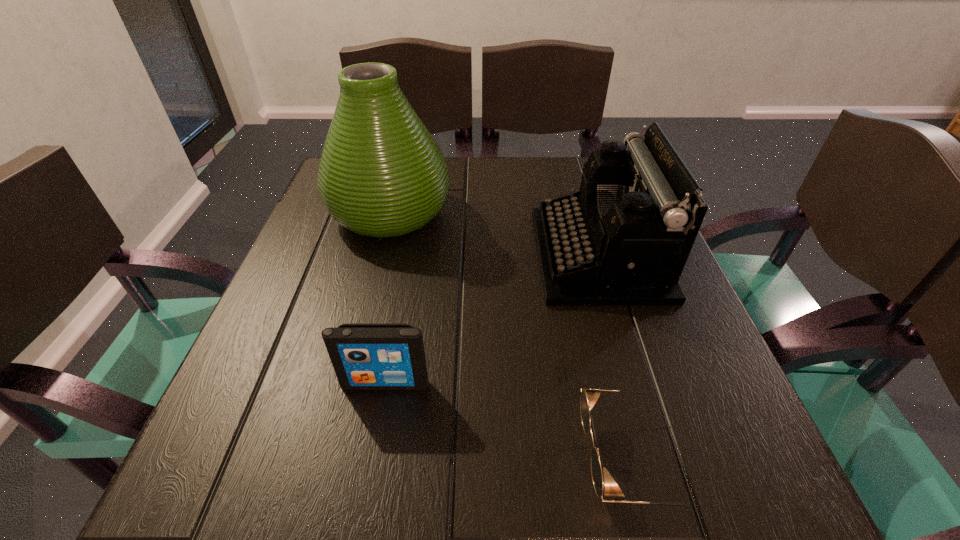
At what (x,y) coordinates should I click in order to perform the action: click on vase. Please return your answer as a coordinate pair (x, y). Image resolution: width=960 pixels, height=540 pixels. Looking at the image, I should click on (381, 174).

What are the coordinates of `typewriter` in the screenshot? It's located at (623, 239).

Identify the location of the second shortest object. The width and height of the screenshot is (960, 540). (364, 356).

The width and height of the screenshot is (960, 540). What are the coordinates of `the third farthest object` in the screenshot? It's located at (364, 356).

This screenshot has height=540, width=960. Identify the location of the shortest object. (589, 397).

I want to click on the nearest object, so click(589, 397).

Image resolution: width=960 pixels, height=540 pixels. I want to click on free point located on the back of the tallest object, so click(x=400, y=170).

Where is `vacant region located 0.400m on the typing side of the second tallest object`? The width and height of the screenshot is (960, 540). vacant region located 0.400m on the typing side of the second tallest object is located at coordinates (340, 255).

Locate an element on the screen. vacant position located 0.190m on the typing side of the second tallest object is located at coordinates pyautogui.click(x=444, y=255).

The width and height of the screenshot is (960, 540). What are the coordinates of `vacant point located on the typing side of the second tallest object` in the screenshot? It's located at (379, 255).